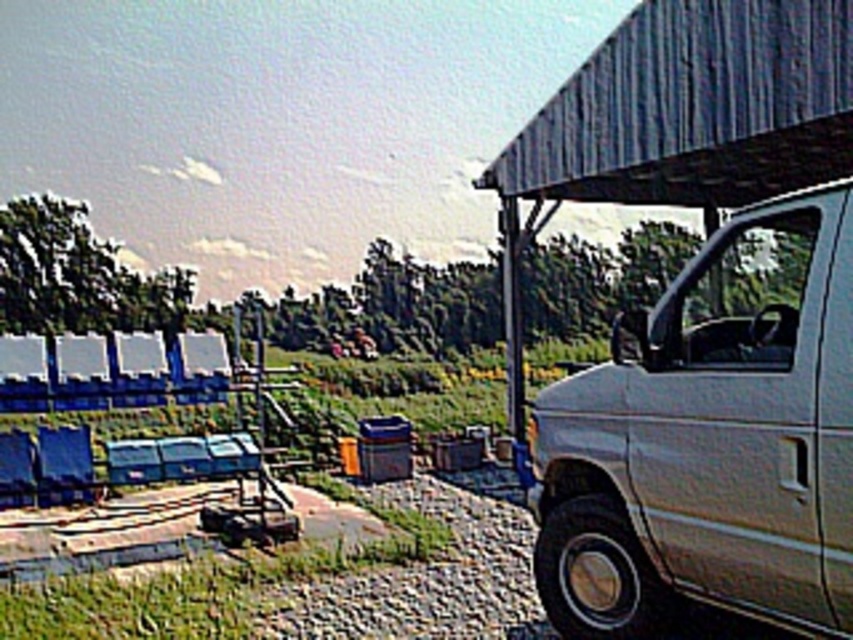
Question: Does white matte van at right have a greater width compared to metallic gray awning at upper right?

Choices:
 (A) yes
 (B) no

Answer: (B)

Question: Which point is closer to the camera?

Choices:
 (A) (782, 332)
 (B) (770, 92)

Answer: (A)

Question: Among these objects, which one is farthest from the camera?

Choices:
 (A) white matte van at right
 (B) metallic gray awning at upper right

Answer: (B)

Question: Does white matte van at right appear on the right side of metallic gray awning at upper right?

Choices:
 (A) yes
 (B) no

Answer: (B)

Question: Can you confirm if white matte van at right is positioned below metallic gray awning at upper right?

Choices:
 (A) no
 (B) yes

Answer: (B)